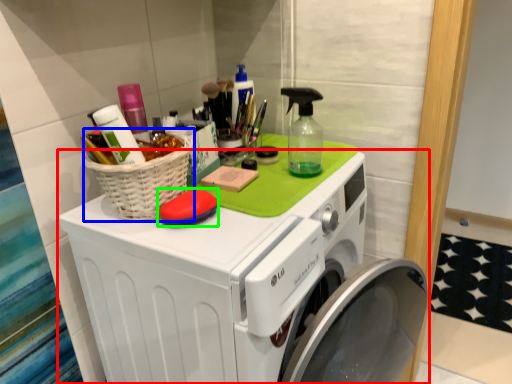
Question: Which object is positioned farthest from washing machine (highlighted by a red box)? Select from basket (highlighted by a blue box) and soap (highlighted by a green box).

Choices:
 (A) basket
 (B) soap

Answer: (B)